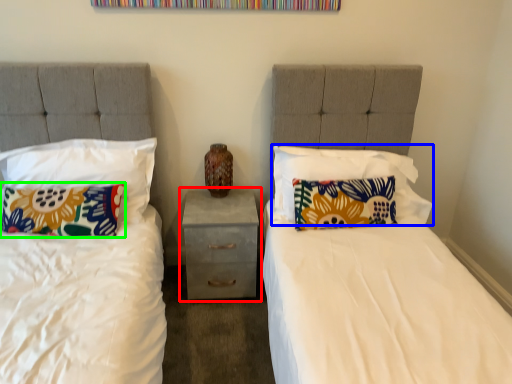
Question: Based on their relative distances, which object is nearer to nightstand (highlighted by a red box)? Choose from pillow (highlighted by a blue box) and pillow (highlighted by a green box).

Choices:
 (A) pillow
 (B) pillow

Answer: (A)